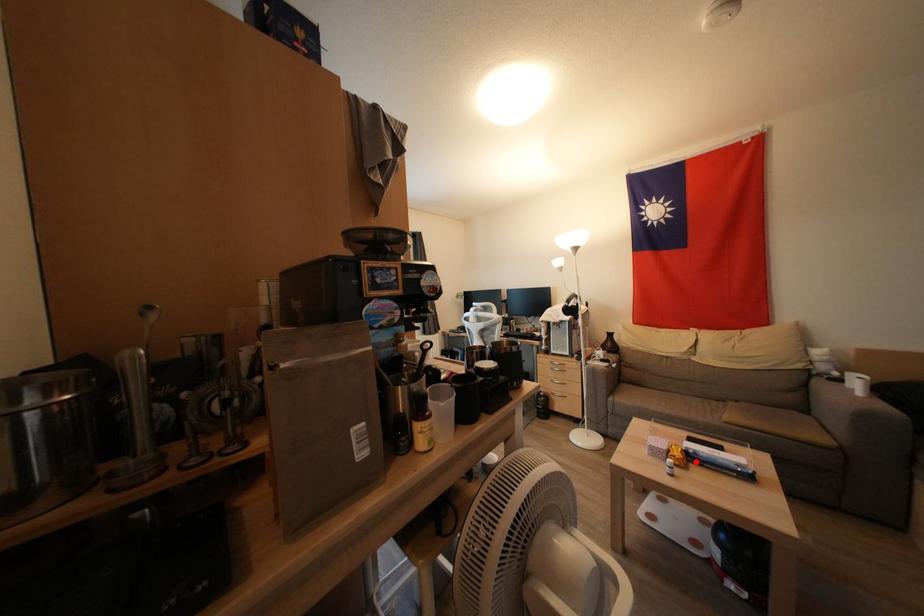
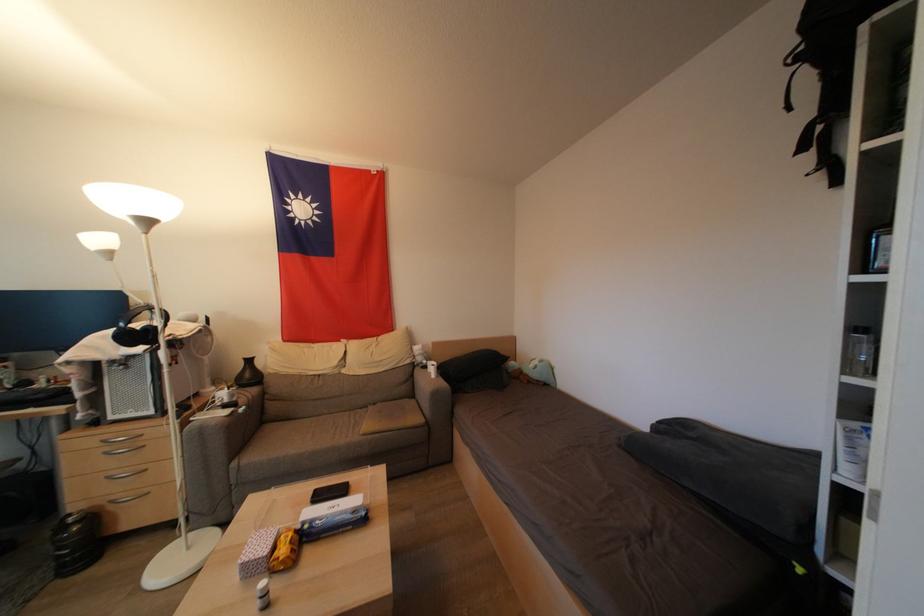
Find the pixel in the second image that matches the highlighted location in the first image.

(310, 541)